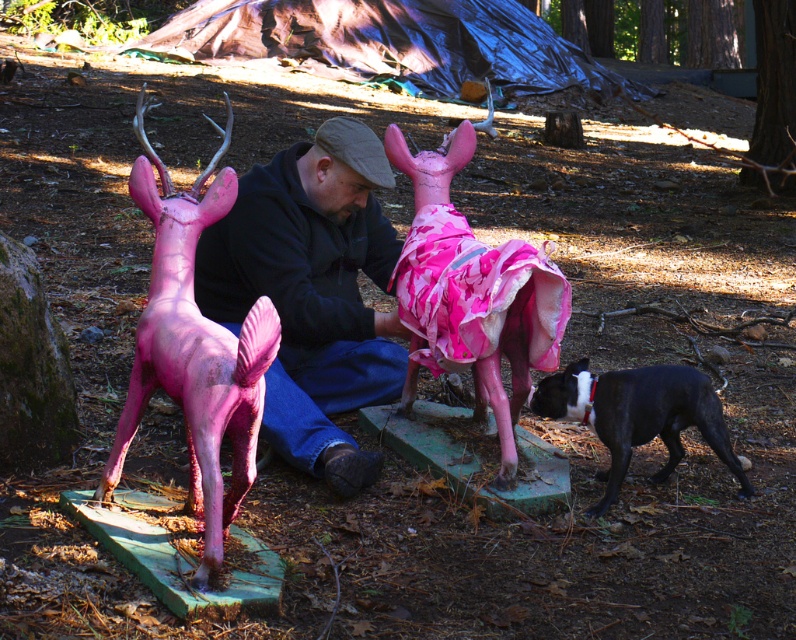
Question: Which object is positioned closest to the black glossy dog at lower right?

Choices:
 (A) matte black hoodie at center
 (B) matte pink plastic deer at left

Answer: (A)

Question: Which is farther from the matte black hoodie at center?

Choices:
 (A) black glossy dog at lower right
 (B) pink matte deer at center

Answer: (A)

Question: Can you confirm if matte black hoodie at center is positioned below matte pink plastic deer at left?

Choices:
 (A) no
 (B) yes

Answer: (A)

Question: Which point is closer to the camera?

Choices:
 (A) matte black hoodie at center
 (B) pink matte deer at center
 (C) black glossy dog at lower right

Answer: (B)

Question: Does matte black hoodie at center lie behind matte pink plastic deer at left?

Choices:
 (A) no
 (B) yes

Answer: (B)

Question: Does matte black hoodie at center appear under matte pink plastic deer at left?

Choices:
 (A) yes
 (B) no

Answer: (B)